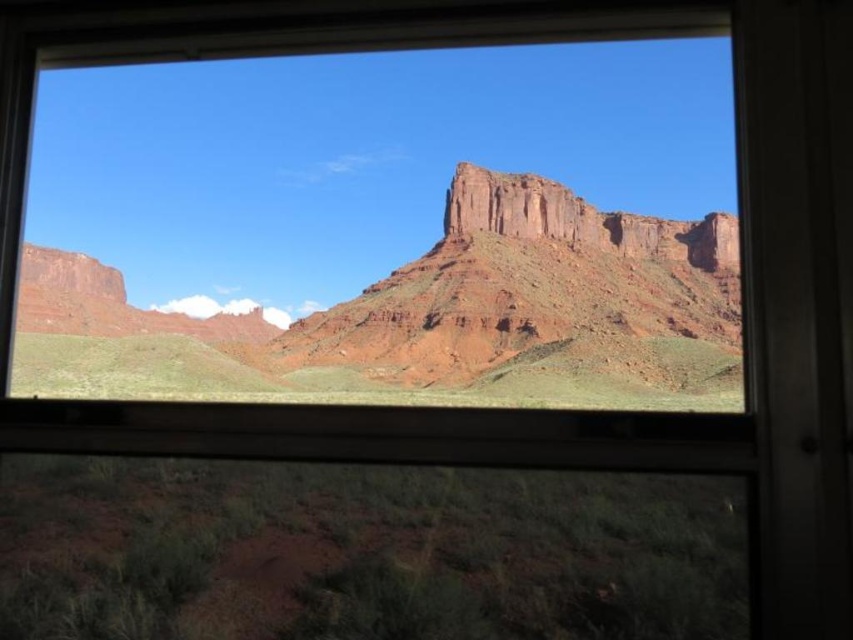
You are standing in a room with a window. You see a rustic sandstone mountain at center and a rustic sandstone cliff at center through the window. Which one is closer to you?

The rustic sandstone mountain at center is closer to you because it is in front of the rustic sandstone cliff at center.

You are an architect designing a new observatory. You want to place it so that it can view both the rustic sandstone mountain at center and the rustic sandstone cliff at center through the window. Since the mountain is taller, will the cliff still be visible below it?

The rustic sandstone mountain at center is taller than the rustic sandstone cliff at center. Since the cliff is shorter, it will still be visible below the mountain as long as there is no obstruction between them.

You are an astronomer observing the desert landscape through the window. You notice two points of interest marked at coordinates point (x=67, y=278) and point (x=456, y=234). Based on your observation, which point is closer to you through the window?

Point (x=456, y=234) is closer to you because point (x=67, y=278) is behind it.